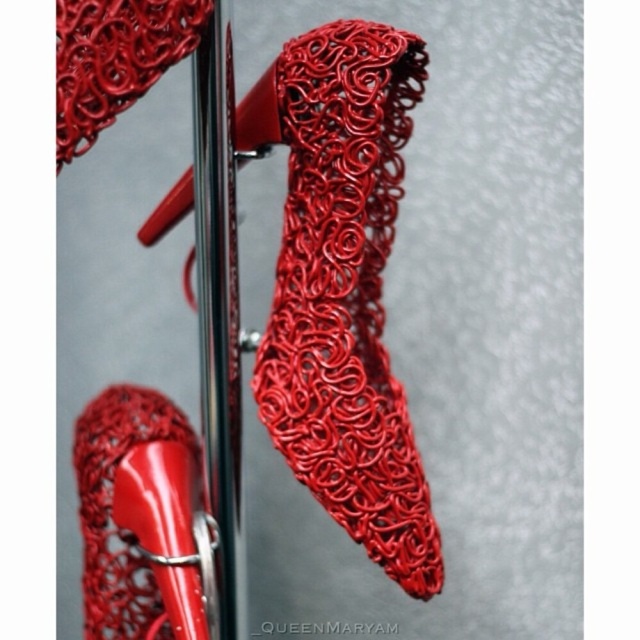
You are an interior designer looking at the image of the shoes. You need to determine where the point at coordinates point (x=346, y=292) is located. Which object from the scene does it belong to?

The point (x=346, y=292) is located on the shiny red wire at center.